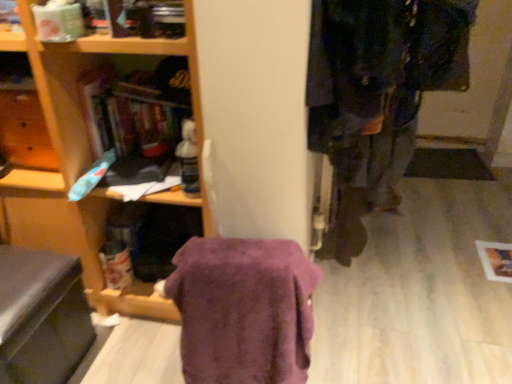
Question: In terms of height, does purple fuzzy blanket at center look taller or shorter compared to dark blue fabric coat at right?

Choices:
 (A) short
 (B) tall

Answer: (B)

Question: From a real-world perspective, is purple fuzzy blanket at center physically located above or below dark blue fabric coat at right?

Choices:
 (A) above
 (B) below

Answer: (B)

Question: Which object is positioned farthest from the black leather swivel chair at lower left?

Choices:
 (A) dark blue fabric coat at right
 (B) purple fuzzy blanket at center

Answer: (A)

Question: Based on their relative distances, which object is farther from the purple fuzzy blanket at center?

Choices:
 (A) black leather swivel chair at lower left
 (B) dark blue fabric coat at right

Answer: (A)